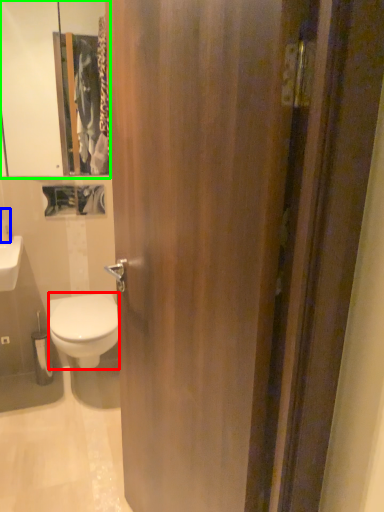
Question: Considering the real-world distances, which object is closest to bidet (highlighted by a red box)? toiletry (highlighted by a blue box) or medicine cabinet (highlighted by a green box).

Choices:
 (A) toiletry
 (B) medicine cabinet

Answer: (A)